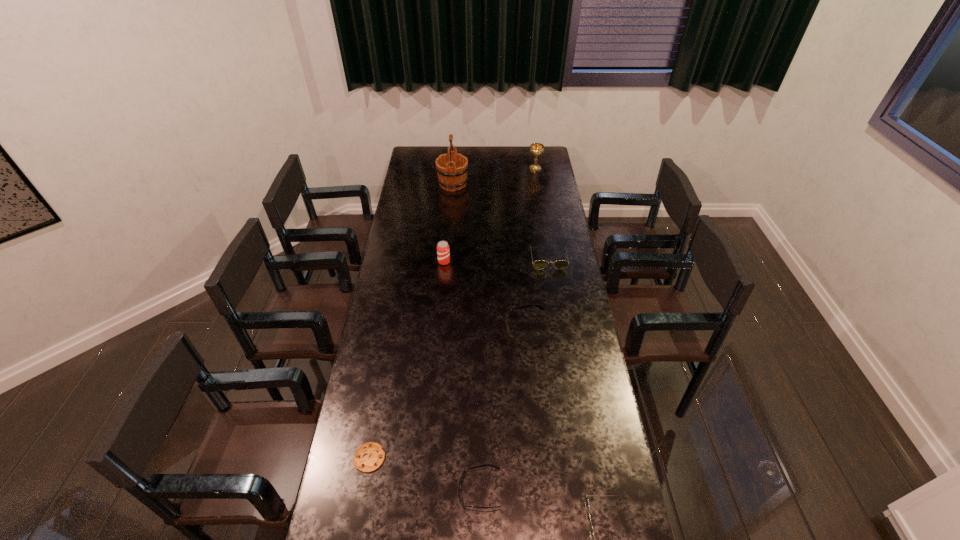
I want to click on the leftmost sunglasses, so click(x=463, y=474).

This screenshot has width=960, height=540. In order to click on the fourth object from left to right in this screenshot , I will do `click(463, 474)`.

This screenshot has width=960, height=540. I want to click on cookie, so click(x=369, y=456).

Where is `the leftmost object`? This screenshot has width=960, height=540. the leftmost object is located at coordinates (369, 456).

Identify the location of free space located on the front of the wine bucket. (451, 209).

This screenshot has width=960, height=540. I want to click on free spot located on the front of the chalice, so click(539, 188).

The width and height of the screenshot is (960, 540). Find the location of `vacant region located on the right of the orange beer can`. vacant region located on the right of the orange beer can is located at coordinates (531, 262).

Find the location of `vacant area situated 0.350m on the front-facing side of the farthest sunglasses`. vacant area situated 0.350m on the front-facing side of the farthest sunglasses is located at coordinates (560, 329).

Identify the location of vacant space located on the lenses of the bigger black sunglasses. The image size is (960, 540). (459, 328).

Where is `free region located on the lenses of the bigger black sunglasses`? This screenshot has width=960, height=540. free region located on the lenses of the bigger black sunglasses is located at coordinates coord(475,328).